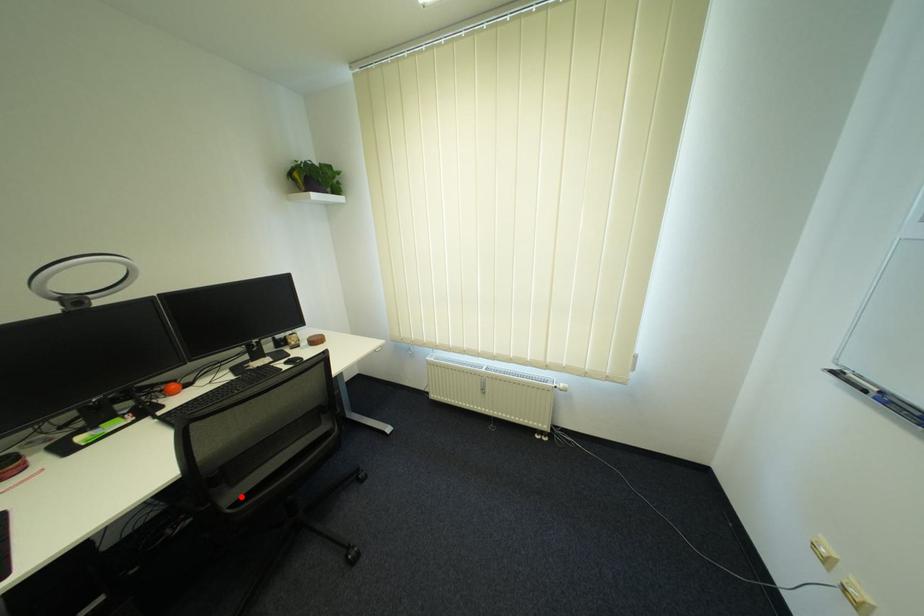
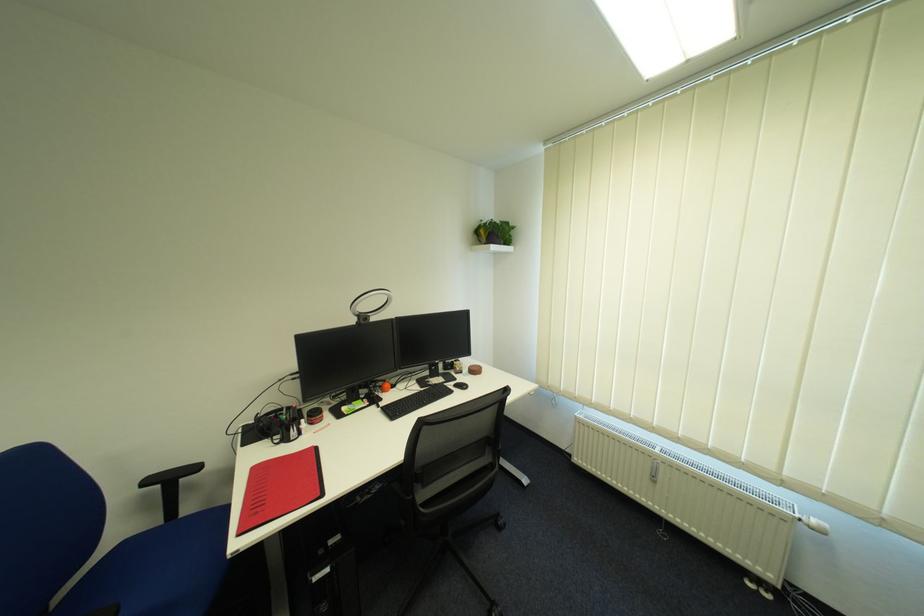
The point at the highlighted location is marked in the first image. Where is the corresponding point in the second image?

(432, 496)